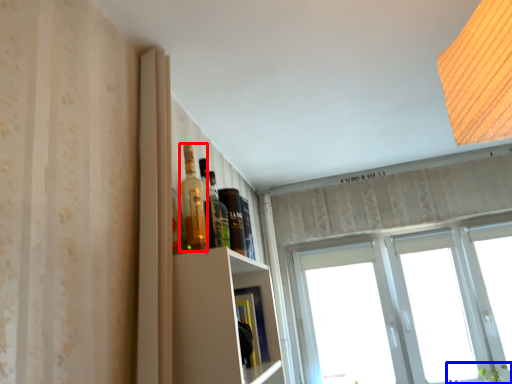
Question: Which object is further to the camera taking this photo, bottle (highlighted by a red box) or plant (highlighted by a blue box)?

Choices:
 (A) bottle
 (B) plant

Answer: (B)